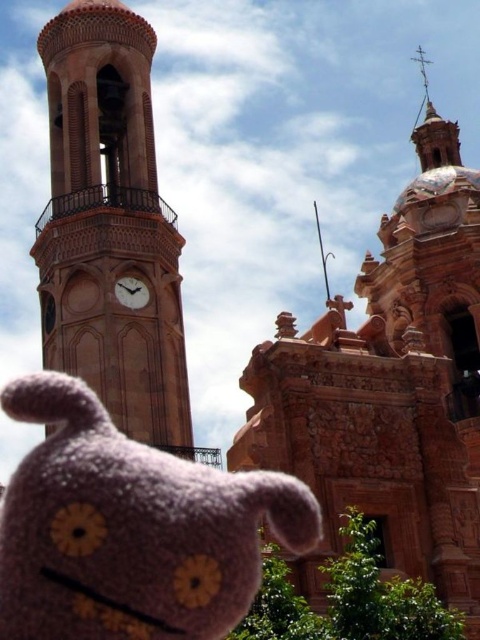
The height and width of the screenshot is (640, 480). What do you see at coordinates (130, 529) in the screenshot?
I see `purple fuzzy toy at lower left` at bounding box center [130, 529].

Is point (97, 616) positioned in front of point (127, 300)?

Yes, point (97, 616) is closer to viewer.

Find the location of a particular element. This screenshot has height=640, width=480. purple fuzzy toy at lower left is located at coordinates (130, 529).

Does brown stone clock tower at left appear on the right side of matte brown clock at center-left?

In fact, brown stone clock tower at left is to the left of matte brown clock at center-left.

Does brown stone clock tower at left appear over matte brown clock at center-left?

Correct, brown stone clock tower at left is located above matte brown clock at center-left.

Which is in front, point (95, 166) or point (135, 294)?

Point (135, 294) is more forward.

Where is `brown stone clock tower at left`? brown stone clock tower at left is located at coordinates (109, 225).

Consider the image. Between purple fuzzy toy at lower left and brown stone clock tower at left, which one is positioned lower?

purple fuzzy toy at lower left is below.

The width and height of the screenshot is (480, 640). What are the coordinates of `purple fuzzy toy at lower left` in the screenshot? It's located at (130, 529).

You are a GUI agent. You are given a task and a screenshot of the screen. Output one action in this format:
    pyautogui.click(x=<x>, y=<y>)
    Task: Click on the purple fuzzy toy at lower left
    
    Given the screenshot: What is the action you would take?
    pyautogui.click(x=130, y=529)